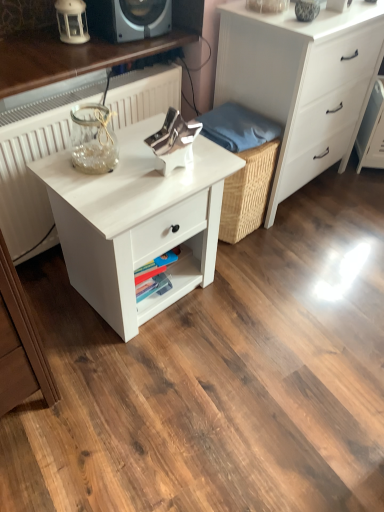
Question: From the image's perspective, is white textured radiator at left under white matte lantern at upper left?

Choices:
 (A) no
 (B) yes

Answer: (B)

Question: Could you tell me if white textured radiator at left is turned towards white matte lantern at upper left?

Choices:
 (A) yes
 (B) no

Answer: (B)

Question: Is white textured radiator at left further to camera compared to white matte lantern at upper left?

Choices:
 (A) yes
 (B) no

Answer: (B)

Question: Is white textured radiator at left bigger than white matte lantern at upper left?

Choices:
 (A) yes
 (B) no

Answer: (A)

Question: Would you say white textured radiator at left is outside white matte lantern at upper left?

Choices:
 (A) no
 (B) yes

Answer: (B)

Question: Is white textured radiator at left inside or outside of white matte nightstand at center?

Choices:
 (A) outside
 (B) inside

Answer: (A)

Question: In terms of width, does white textured radiator at left look wider or thinner when compared to white matte nightstand at center?

Choices:
 (A) thin
 (B) wide

Answer: (B)

Question: Is white textured radiator at left taller or shorter than white matte nightstand at center?

Choices:
 (A) short
 (B) tall

Answer: (B)

Question: Considering the relative positions of white textured radiator at left and white matte nightstand at center in the image provided, is white textured radiator at left to the left or to the right of white matte nightstand at center?

Choices:
 (A) left
 (B) right

Answer: (A)

Question: Choose the correct answer: Is blue fabric at center inside white textured radiator at left or outside it?

Choices:
 (A) outside
 (B) inside

Answer: (A)

Question: Considering the positions of blue fabric at center and white textured radiator at left in the image, is blue fabric at center bigger or smaller than white textured radiator at left?

Choices:
 (A) big
 (B) small

Answer: (B)

Question: From a real-world perspective, is blue fabric at center physically located above or below white textured radiator at left?

Choices:
 (A) above
 (B) below

Answer: (A)

Question: In the image, is blue fabric at center positioned in front of or behind white textured radiator at left?

Choices:
 (A) behind
 (B) front

Answer: (A)

Question: Looking at the image, does white matte nightstand at center seem bigger or smaller compared to blue fabric at center?

Choices:
 (A) small
 (B) big

Answer: (B)

Question: In the image, is white matte nightstand at center positioned in front of or behind blue fabric at center?

Choices:
 (A) front
 (B) behind

Answer: (A)